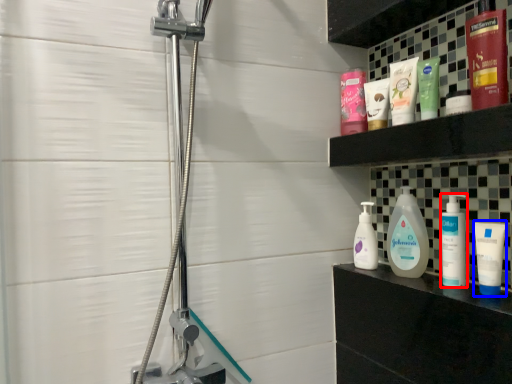
Question: Which object is closer to the camera taking this photo, toiletry (highlighted by a red box) or toiletry (highlighted by a blue box)?

Choices:
 (A) toiletry
 (B) toiletry

Answer: (B)